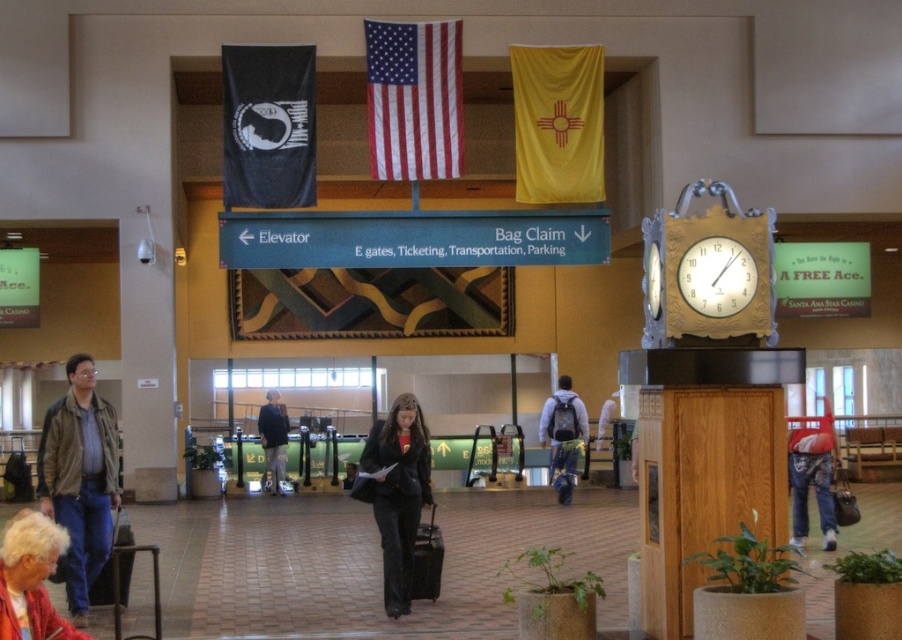
What do you see at coordinates (413, 99) in the screenshot? This screenshot has width=902, height=640. I see `american flag at center` at bounding box center [413, 99].

Which is behind, point (420, 42) or point (820, 499)?

Point (420, 42)

The height and width of the screenshot is (640, 902). In order to click on american flag at center in this screenshot , I will do `click(413, 99)`.

At what (x,y) coordinates should I click in order to perform the action: click on american flag at center. Please return your answer as a coordinate pair (x, y). Looking at the image, I should click on 413,99.

Is point (646, 264) behind point (123, 518)?

No.

At what (x,y) coordinates should I click in order to perform the action: click on gold ornate clock at upper right. Please return your answer as a coordinate pair (x, y). Looking at the image, I should click on (707, 269).

Can you confirm if gold ornate clock at upper right is positioned to the left of black textured suitcase at center?

In fact, gold ornate clock at upper right is to the right of black textured suitcase at center.

Does gold ornate clock at upper right appear under black textured suitcase at center?

No.

Which is behind, point (645, 273) or point (420, 579)?

The point (420, 579) is behind.

At what (x,y) coordinates should I click in order to perform the action: click on gold ornate clock at upper right. Please return your answer as a coordinate pair (x, y). Looking at the image, I should click on (707, 269).